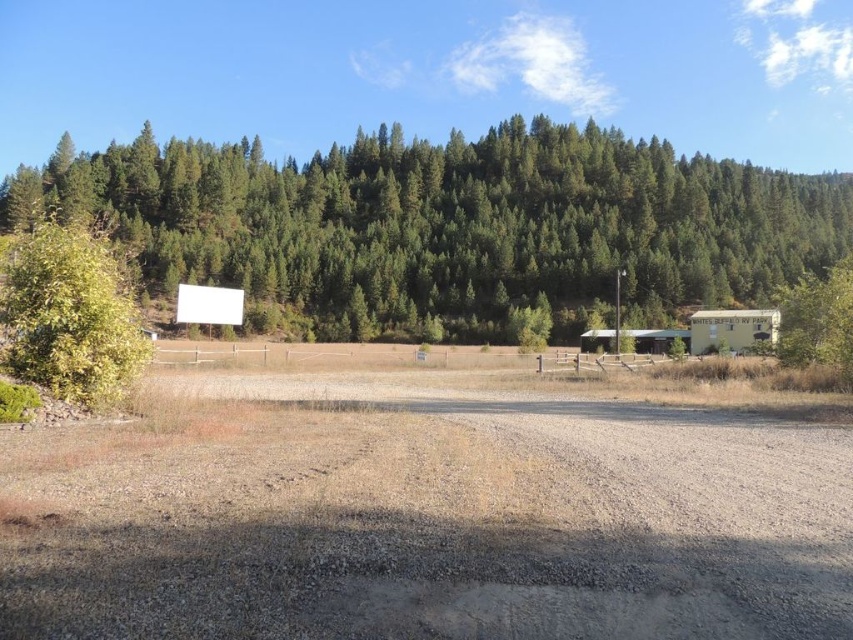
Question: Which object appears farthest from the camera in this image?

Choices:
 (A) green textured pine trees at upper center
 (B) brown gravelly dirt field at center

Answer: (A)

Question: Can you confirm if brown gravelly dirt field at center is bigger than green textured pine trees at upper center?

Choices:
 (A) no
 (B) yes

Answer: (A)

Question: Is brown gravelly dirt field at center thinner than green leafy bush at left?

Choices:
 (A) no
 (B) yes

Answer: (A)

Question: Among these objects, which one is nearest to the camera?

Choices:
 (A) brown gravelly dirt field at center
 (B) green textured pine trees at upper center

Answer: (A)

Question: Does green textured pine trees at upper center have a greater width compared to green leafy bush at left?

Choices:
 (A) yes
 (B) no

Answer: (A)

Question: Which object is closer to the camera taking this photo?

Choices:
 (A) green textured pine trees at upper center
 (B) green leafy bush at left

Answer: (B)